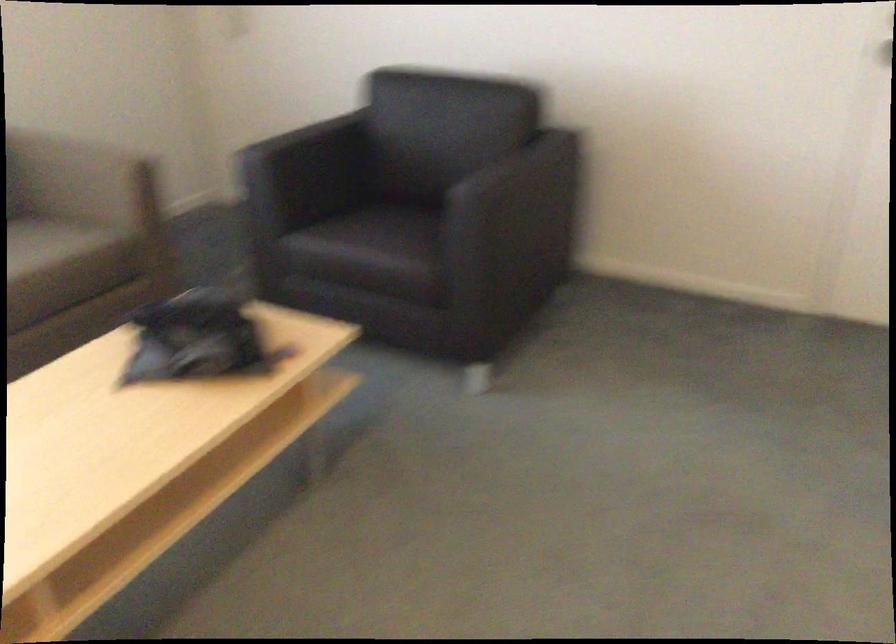
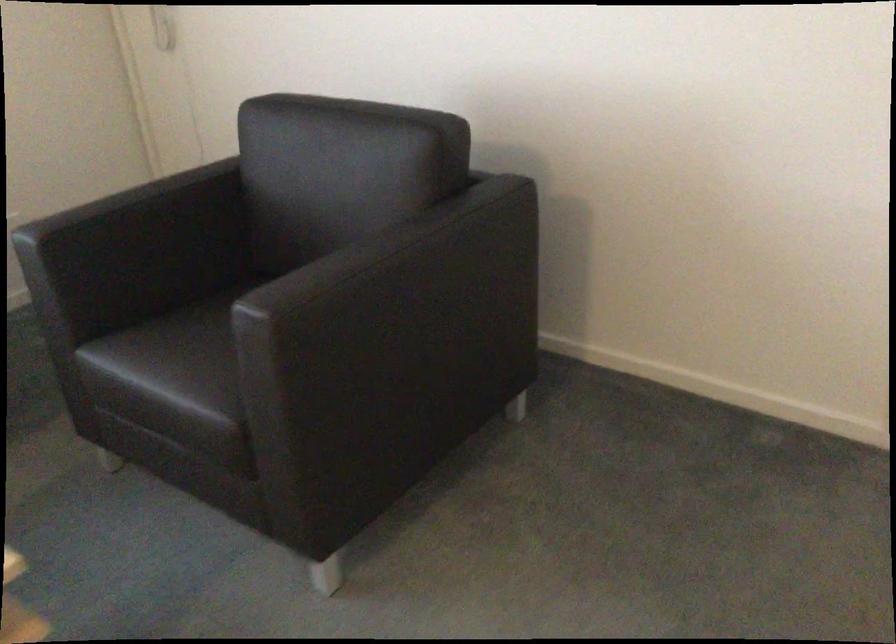
The point at [319,149] is marked in the first image. Where is the corresponding point in the second image?

(147, 225)